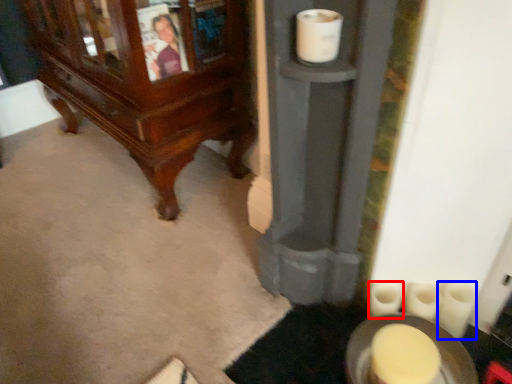
Question: Which point is further to the camera, toilet paper (highlighted by a red box) or toilet paper (highlighted by a blue box)?

Choices:
 (A) toilet paper
 (B) toilet paper

Answer: (A)